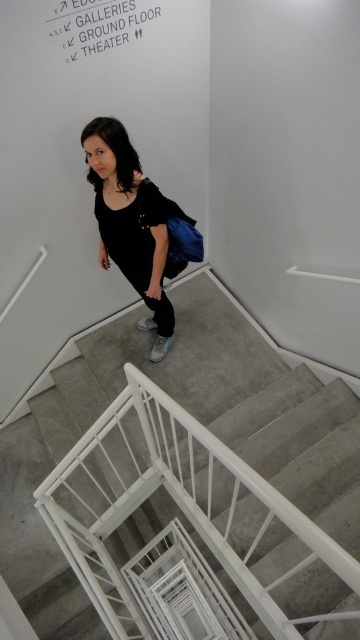
In the scene shown: Between black matte dress at center and white paper sign at upper center, which one has less height?

Standing shorter between the two is white paper sign at upper center.

Does black matte dress at center have a larger size compared to white paper sign at upper center?

Yes, black matte dress at center is bigger than white paper sign at upper center.

Between point (123, 228) and point (127, 32), which one is positioned behind?

The point (127, 32) is more distant.

This screenshot has width=360, height=640. I want to click on black matte dress at center, so click(x=135, y=230).

Does point (129, 228) come behind point (182, 262)?

No.

Is point (123, 140) closer to viewer compared to point (150, 268)?

Yes, point (123, 140) is closer to viewer.

This screenshot has width=360, height=640. What do you see at coordinates (132, 221) in the screenshot?
I see `matte black dress at center` at bounding box center [132, 221].

Locate an element on the screen. matte black dress at center is located at coordinates (132, 221).

Looking at this image, does carpeted stairs at center appear on the left side of black matte dress at center?

Incorrect, carpeted stairs at center is not on the left side of black matte dress at center.

Does carpeted stairs at center have a smaller size compared to black matte dress at center?

No, carpeted stairs at center is not smaller than black matte dress at center.

Image resolution: width=360 pixels, height=640 pixels. I want to click on carpeted stairs at center, so click(x=196, y=419).